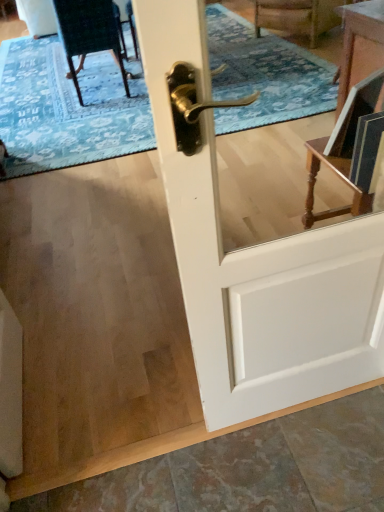
Question: From a real-world perspective, is velvet dark green chair at upper left below blue textured rug at upper center?

Choices:
 (A) no
 (B) yes

Answer: (A)

Question: Is velvet dark green chair at upper left bigger than blue textured rug at upper center?

Choices:
 (A) no
 (B) yes

Answer: (A)

Question: From the image's perspective, is velvet dark green chair at upper left beneath blue textured rug at upper center?

Choices:
 (A) no
 (B) yes

Answer: (B)

Question: Is blue textured rug at upper center a part of velvet dark green chair at upper left?

Choices:
 (A) yes
 (B) no

Answer: (B)

Question: Does velvet dark green chair at upper left have a greater width compared to blue textured rug at upper center?

Choices:
 (A) no
 (B) yes

Answer: (A)

Question: Does velvet dark green chair at upper left have a smaller size compared to blue textured rug at upper center?

Choices:
 (A) yes
 (B) no

Answer: (A)

Question: Is velvet dark green chair at upper left at the left side of white glossy door at center?

Choices:
 (A) no
 (B) yes

Answer: (B)

Question: From the image's perspective, is velvet dark green chair at upper left on top of white glossy door at center?

Choices:
 (A) yes
 (B) no

Answer: (A)

Question: Can we say velvet dark green chair at upper left lies outside white glossy door at center?

Choices:
 (A) yes
 (B) no

Answer: (A)

Question: Can you confirm if velvet dark green chair at upper left is bigger than white glossy door at center?

Choices:
 (A) yes
 (B) no

Answer: (A)

Question: From the image's perspective, would you say velvet dark green chair at upper left is shown under white glossy door at center?

Choices:
 (A) yes
 (B) no

Answer: (B)

Question: Is velvet dark green chair at upper left positioned before white glossy door at center?

Choices:
 (A) yes
 (B) no

Answer: (B)

Question: Is the surface of white glossy door at center in direct contact with blue textured rug at upper center?

Choices:
 (A) yes
 (B) no

Answer: (B)